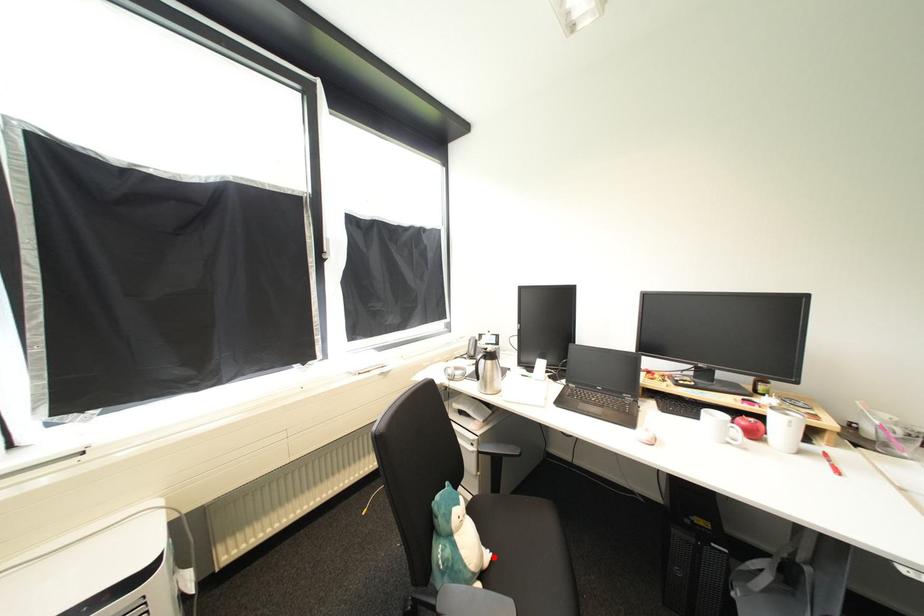
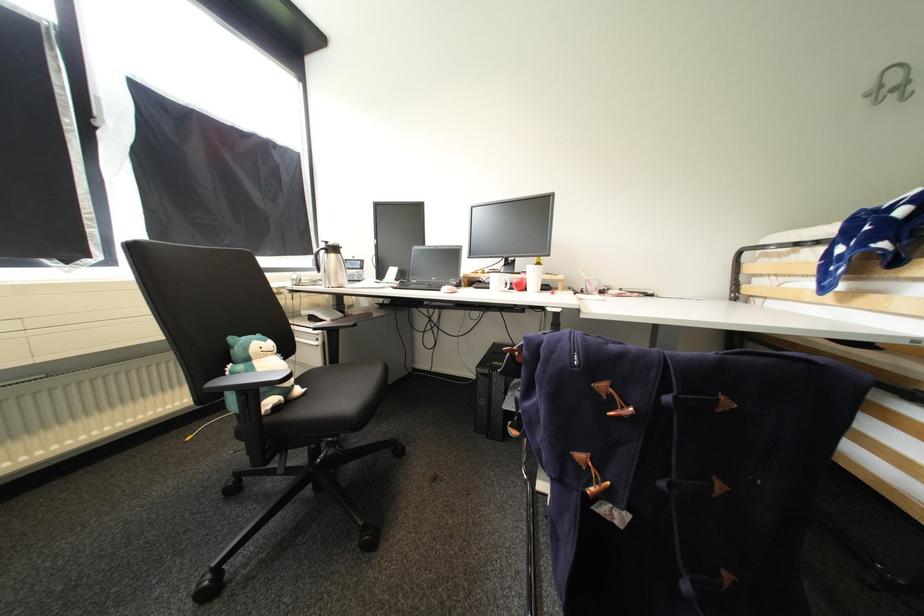
In the second image, find the point that corresponds to the highlighted location in the first image.

(306, 391)